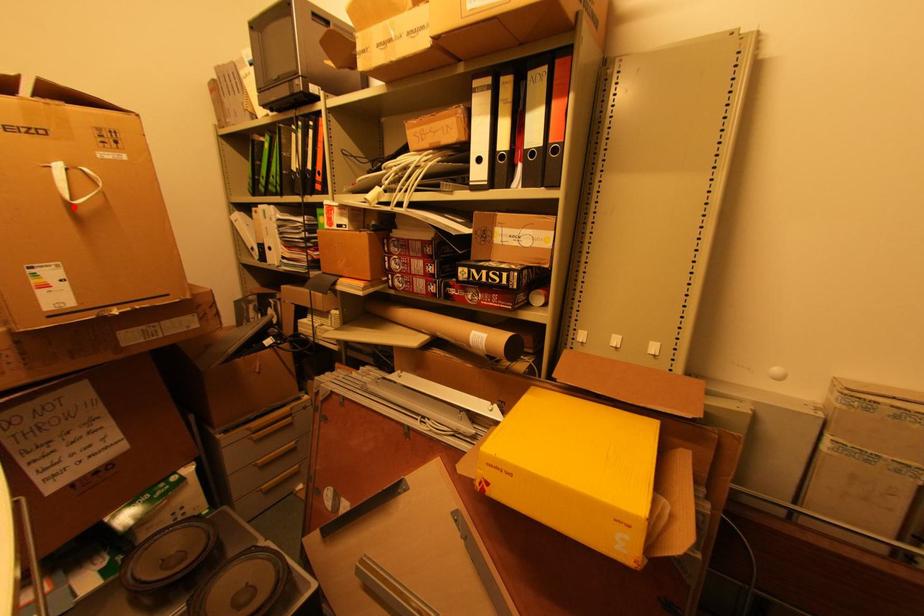
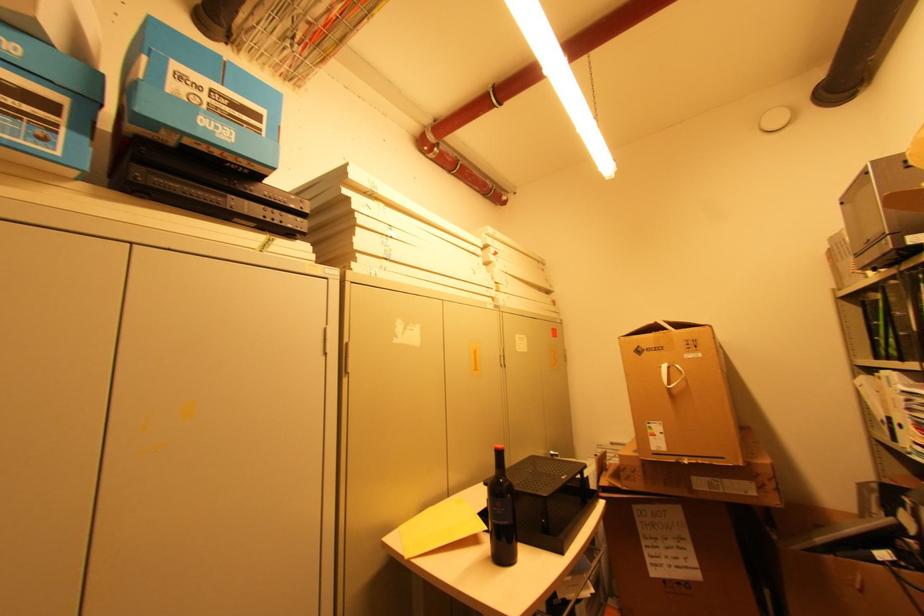
The point at the highlighted location is marked in the first image. Where is the corresponding point in the second image?

(672, 390)